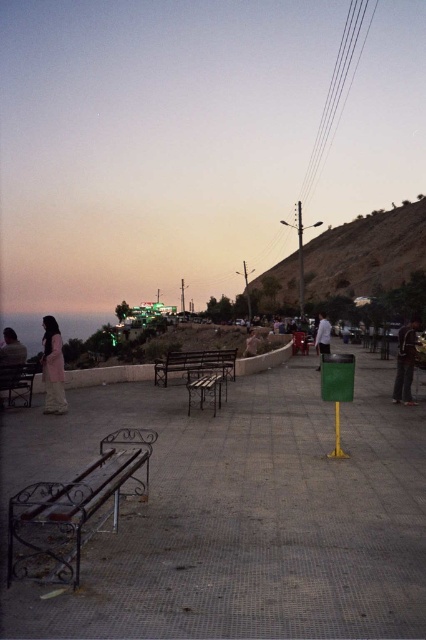
You are a photographer setting up a tripod in the park. You need to place it between the dark blue jeans at right and the metallic silver bench at center. Given that the tripod requires a minimum of 1 meter of space to set up, can you determine if there is enough space between them?

The dark blue jeans at right has a smaller size compared to metallic silver bench at center, but the description does not provide the distance between them. Therefore, it is impossible to determine if there is enough space for the tripod.

You are standing in the park and see the dark blue jeans at right and the metallic silver bench at center. Which object is closer to you?

The dark blue jeans at right are closer to you because the metallic silver bench at center is behind them.

You are standing in the park and see the metallic bench at center and the dark blue jeans at right. Which object is positioned more to the right side of the scene?

The dark blue jeans at right are positioned more to the right side of the scene than the metallic bench at center.